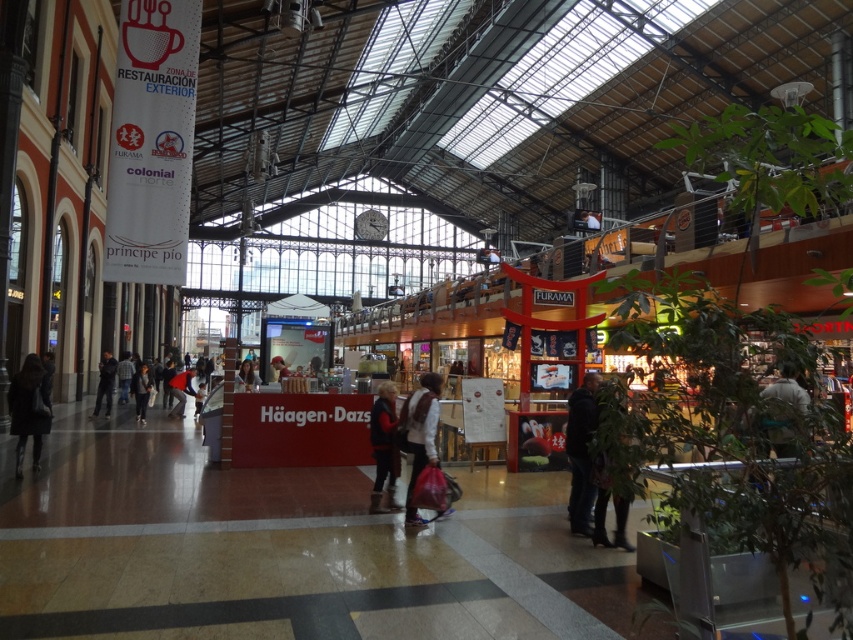
Question: Among these points, which one is nearest to the camera?

Choices:
 (A) (625, 547)
 (B) (102, 381)

Answer: (A)

Question: Considering the relative positions of dark brown leather coat at lower left and dark blue jeans at left in the image provided, where is dark brown leather coat at lower left located with respect to dark blue jeans at left?

Choices:
 (A) below
 (B) above

Answer: (B)

Question: Can you confirm if dark brown leather coat at lower left is positioned to the left of dark brown leather boots at lower right?

Choices:
 (A) yes
 (B) no

Answer: (A)

Question: Which object is farther from the camera taking this photo?

Choices:
 (A) dark brown leather coat at lower left
 (B) matte black jacket at center
 (C) white cotton jacket at center

Answer: (B)

Question: Which of the following is the closest to the observer?

Choices:
 (A) dark brown leather boots at lower right
 (B) dark blue jeans at left

Answer: (A)

Question: Does dark blue jeans at center have a smaller size compared to matte black jacket at center?

Choices:
 (A) no
 (B) yes

Answer: (B)